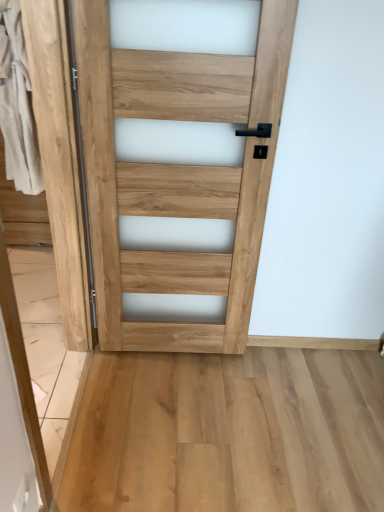
Question: Relative to natural wood door at center, is natural wood barn door at center in front or behind?

Choices:
 (A) behind
 (B) front

Answer: (B)

Question: From a real-world perspective, is natural wood barn door at center above or below natural wood door at center?

Choices:
 (A) below
 (B) above

Answer: (A)

Question: Considering the positions of natural wood barn door at center and natural wood door at center in the image, is natural wood barn door at center taller or shorter than natural wood door at center?

Choices:
 (A) tall
 (B) short

Answer: (B)

Question: In terms of size, does natural wood door at center appear bigger or smaller than natural wood barn door at center?

Choices:
 (A) small
 (B) big

Answer: (A)

Question: Is natural wood door at center taller or shorter than natural wood barn door at center?

Choices:
 (A) tall
 (B) short

Answer: (A)

Question: Looking at their shapes, would you say natural wood door at center is wider or thinner than natural wood barn door at center?

Choices:
 (A) wide
 (B) thin

Answer: (B)

Question: From a real-world perspective, relative to natural wood barn door at center, is natural wood door at center vertically above or below?

Choices:
 (A) below
 (B) above

Answer: (B)